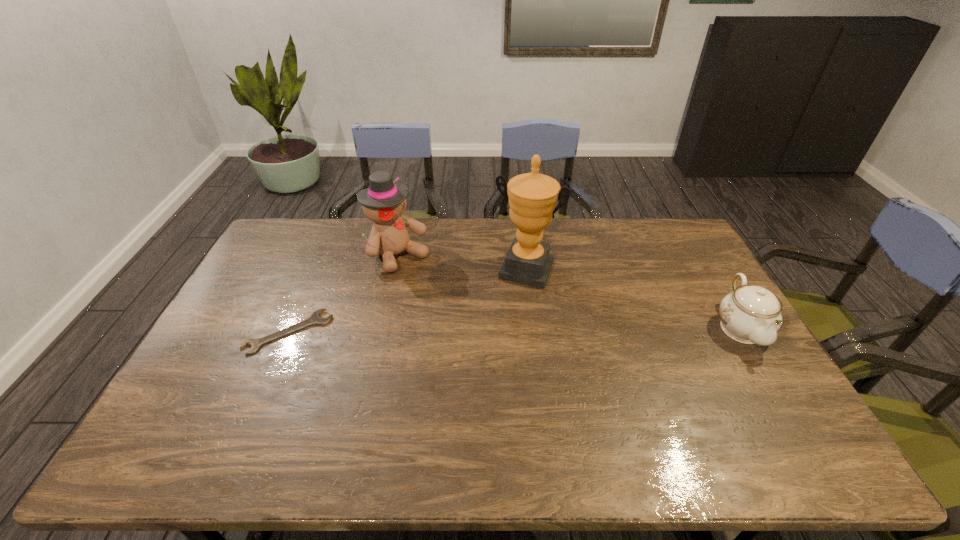
Identify the location of free space on the desktop that is between the wrench and the rightmost object and is positioned at the front of the second object from right to left with handles. (502, 330).

Where is `vacant space on the desktop that is between the wrench and the rightmost object and is positioned on the front-facing side of the rag_doll`? vacant space on the desktop that is between the wrench and the rightmost object and is positioned on the front-facing side of the rag_doll is located at coordinates [492, 330].